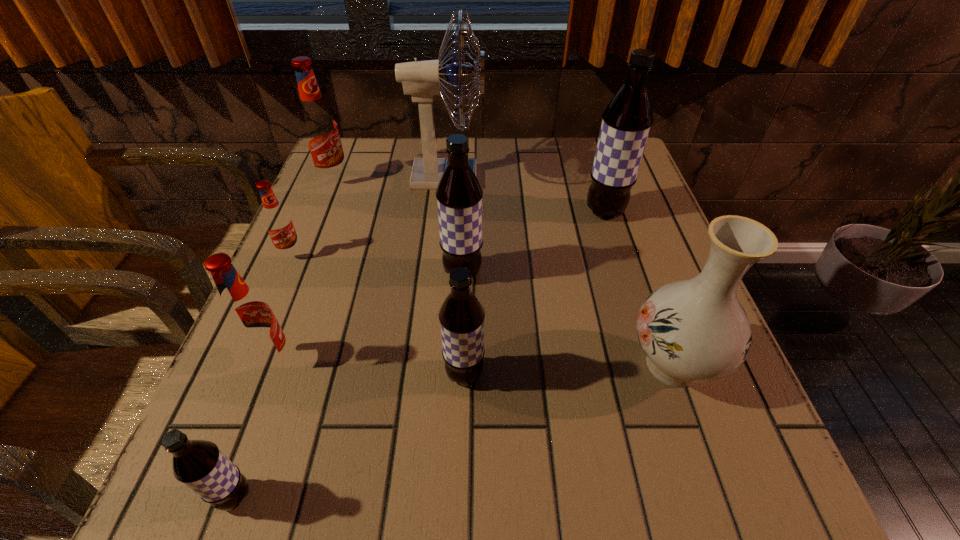
Where is `vacant space at the left edge of the desktop`? Image resolution: width=960 pixels, height=540 pixels. vacant space at the left edge of the desktop is located at coordinates (324, 223).

Locate an element on the screen. The image size is (960, 540). vacant area at the right edge of the desktop is located at coordinates click(636, 227).

In the image, there is a desktop. Identify the location of vacant space at the far left corner. (345, 137).

I want to click on free space that is in between the second biggest red root beer and the fan, so click(x=360, y=269).

Find the location of a particular element. This screenshot has height=540, width=960. free space between the third farthest brown root beer and the nearest object is located at coordinates (349, 435).

Where is `vacant point located between the farthest brown root beer and the nearest brown root beer`? This screenshot has height=540, width=960. vacant point located between the farthest brown root beer and the nearest brown root beer is located at coordinates (420, 354).

This screenshot has width=960, height=540. Identify the location of free space between the nearest red root beer and the second farthest brown root beer. (369, 316).

What are the coordinates of `free space between the second biggest red root beer and the tallest root beer` in the screenshot? It's located at (440, 286).

At what (x,y) coordinates should I click in order to perform the action: click on unoccupied area between the nearest brown root beer and the vase. Please return your answer as a coordinate pair (x, y). Looking at the image, I should click on (454, 430).

Identify the location of unoccupied position between the second smallest brown root beer and the second nearest red root beer. [378, 314].